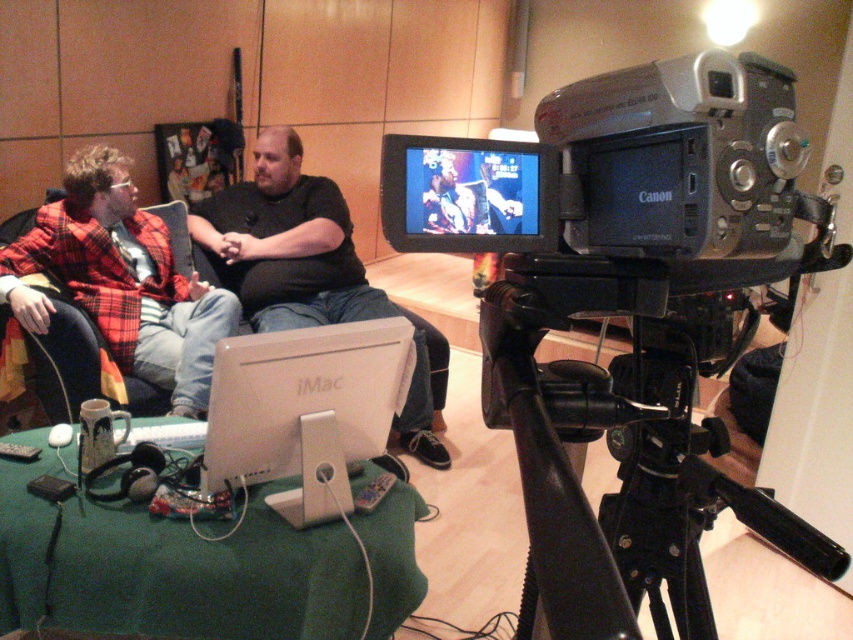
Which of these two, plaid fabric jacket at left or black matte shirt at center, stands shorter?

With less height is plaid fabric jacket at left.

Can you confirm if plaid fabric jacket at left is thinner than black matte shirt at center?

Correct, plaid fabric jacket at left's width is less than black matte shirt at center's.

Which is behind, point (44, 326) or point (323, 273)?

The point (323, 273) is more distant.

Locate an element on the screen. plaid fabric jacket at left is located at coordinates (120, 282).

The width and height of the screenshot is (853, 640). What do you see at coordinates (650, 332) in the screenshot?
I see `silver/black plastic video camera at center` at bounding box center [650, 332].

This screenshot has width=853, height=640. In order to click on silver/black plastic video camera at center in this screenshot , I will do `click(650, 332)`.

The width and height of the screenshot is (853, 640). What are the coordinates of `silver/black plastic video camera at center` in the screenshot? It's located at (650, 332).

Between silver/black plastic video camera at center and white glossy imac at center, which one is positioned higher?

Positioned higher is white glossy imac at center.

Which is more to the left, silver/black plastic video camera at center or white glossy imac at center?

white glossy imac at center is more to the left.

Find the location of a particular element. silver/black plastic video camera at center is located at coordinates click(x=650, y=332).

The height and width of the screenshot is (640, 853). In order to click on silver/black plastic video camera at center in this screenshot , I will do `click(650, 332)`.